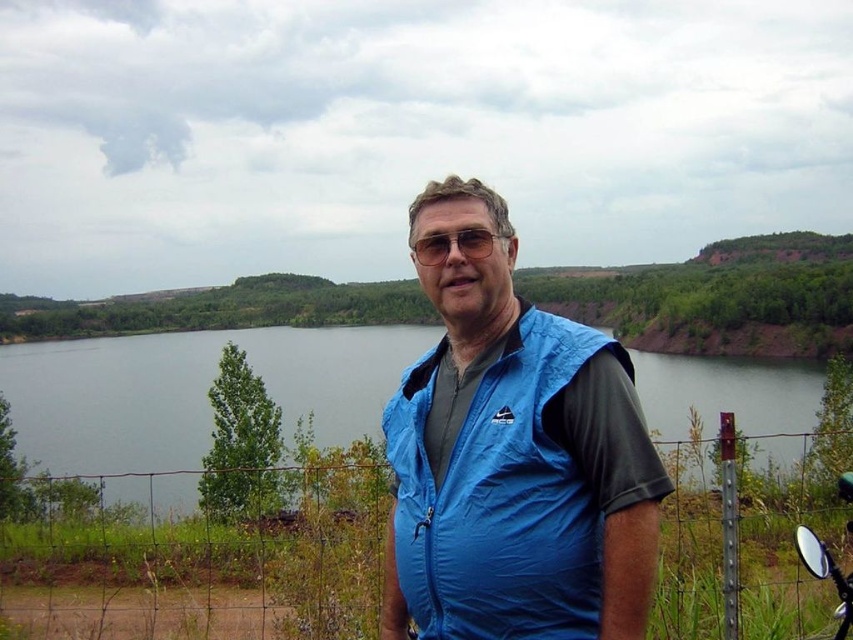
You are a swimmer who wants to jump into the blue water at center. You have the clear plastic goggles at center with you. Can you safely jump into the water without hitting the goggles?

The blue water at center might be wider than clear plastic goggles at center, so there is a possibility that you can safely jump into the blue water at center without hitting the clear plastic goggles at center. However, the exact distance is uncertain based on the provided information.

You are a hiker who wants to cross the blue water at center while wearing the clear plastic goggles at center. Can you see the goggles clearly through the water?

The blue water at center is much taller than the clear plastic goggles at center, so the goggles will be submerged and you won t be able to see them clearly through the water.

You are standing at point point (x=410, y=252) and want to move to point point (x=219, y=348). Which direction should you move to reach your destination?

You should move towards the camera direction because point (x=219, y=348) is further to the camera than point (x=410, y=252).